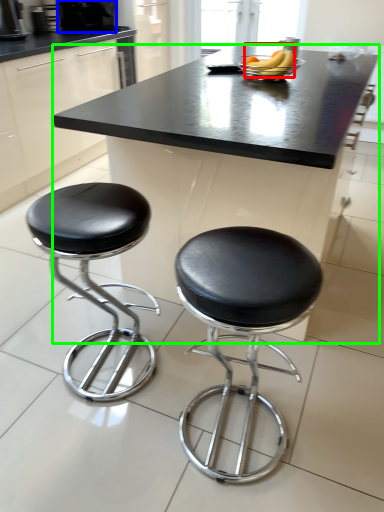
Question: Considering the real-world distances, which object is closest to banana (highlighted by a red box)? coffee machine (highlighted by a blue box) or table (highlighted by a green box).

Choices:
 (A) coffee machine
 (B) table

Answer: (B)